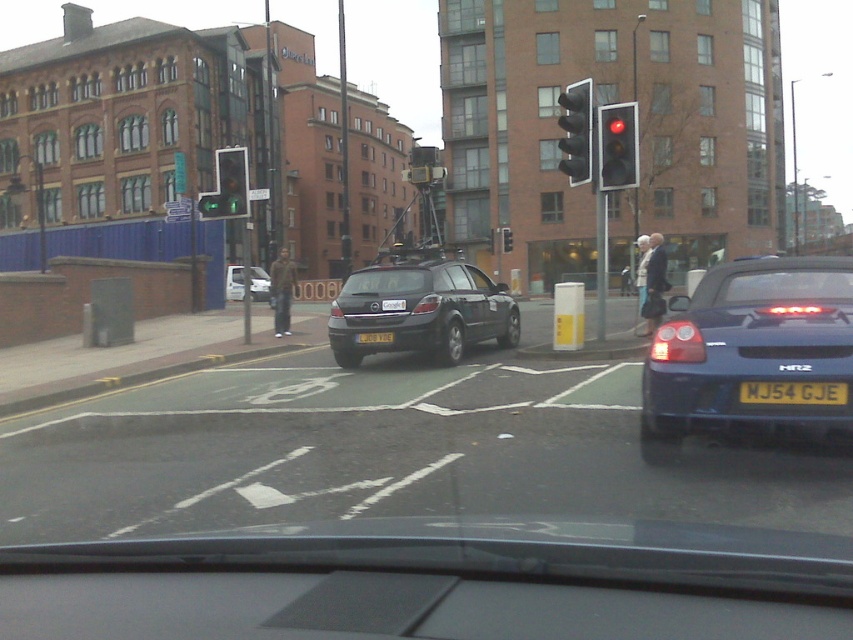
Question: Can you confirm if black plastic traffic light at upper center is positioned to the right of yellow metallic license plate at center?

Choices:
 (A) yes
 (B) no

Answer: (A)

Question: Considering the relative positions of transparent plastic windshield at center and yellow metallic license plate at center in the image provided, where is transparent plastic windshield at center located with respect to yellow metallic license plate at center?

Choices:
 (A) above
 (B) below

Answer: (A)

Question: Among these objects, which one is nearest to the camera?

Choices:
 (A) matte black hatchback at center
 (B) white glossy car at center

Answer: (A)

Question: From the image, what is the correct spatial relationship of clear glass windshield at center in relation to yellow plastic license plate at center?

Choices:
 (A) left
 (B) right

Answer: (B)

Question: Which object is farther from the camera taking this photo?

Choices:
 (A) yellow plastic license plate at center
 (B) black plastic traffic light at center

Answer: (B)

Question: Which point is farther from the camera taking this photo?

Choices:
 (A) (631, 131)
 (B) (577, 108)
 (C) (762, 296)
 (D) (827, 392)

Answer: (B)